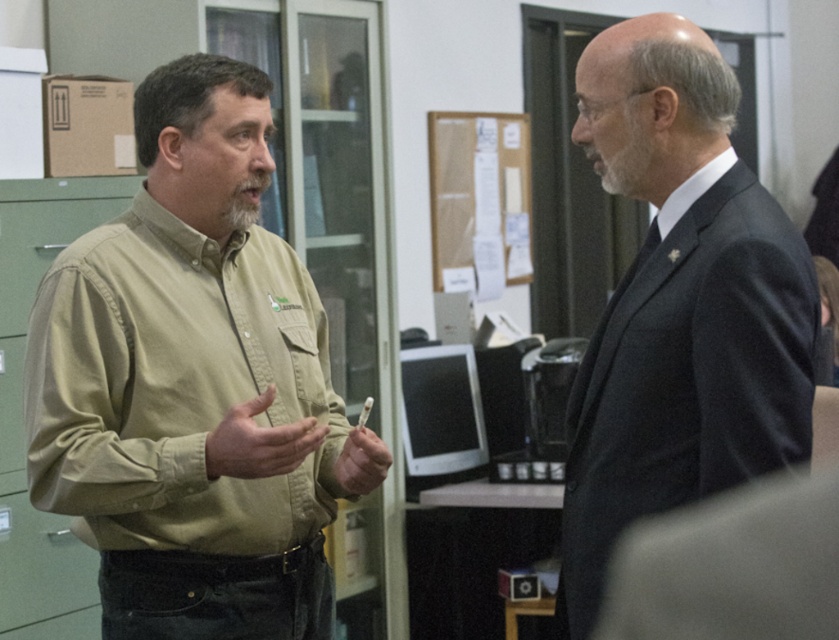
Who is positioned more to the right, dark gray suit at right or green fabric file cabinet at left?

dark gray suit at right is more to the right.

The height and width of the screenshot is (640, 839). Identify the location of dark gray suit at right. (688, 378).

Is point (675, 42) behind point (712, 625)?

That is True.

What do you see at coordinates (688, 378) in the screenshot? Image resolution: width=839 pixels, height=640 pixels. I see `dark gray suit at right` at bounding box center [688, 378].

Locate an element on the screen. dark gray suit at right is located at coordinates (688, 378).

Can you confirm if green fabric file cabinet at left is smaller than white smooth shirt at upper right?

No.

Is green fabric file cabinet at left above white smooth shirt at upper right?

No.

Is point (40, 200) behind point (664, 205)?

Yes, it is.

Locate an element on the screen. The height and width of the screenshot is (640, 839). green fabric file cabinet at left is located at coordinates pyautogui.click(x=22, y=410).